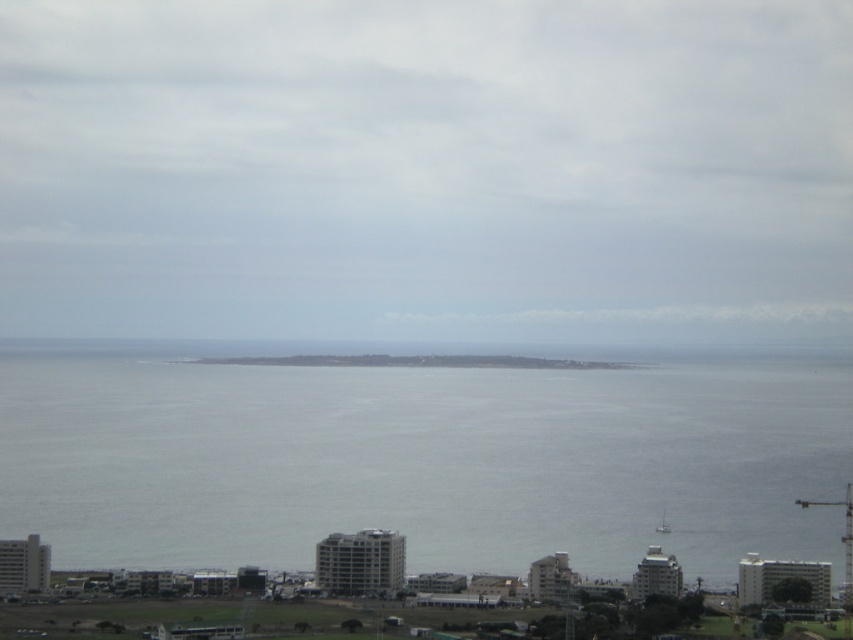
You are standing on the gray concrete coast at center and looking towards the gray water at center. Which object is closer to you?

The gray water at center is closer to you because it is in front of the gray concrete coast at center.

Consider the image. You are a city planner reviewing this coastal area. You notice the gray water at center and the gray concrete coast at center. Which of these two features appears to occupy a larger vertical space in the image?

The gray water at center is much taller than the gray concrete coast at center, so it occupies a larger vertical space in the image.

Based on the photo, you are standing at the camera position observing the coastal cityscape. There is a point marked at coordinates point (194, 365). Can you determine if this point is closer to the camera than 700 meters?

The point (194, 365) is 655.54 meters away from the camera, so it is closer than 700 meters.